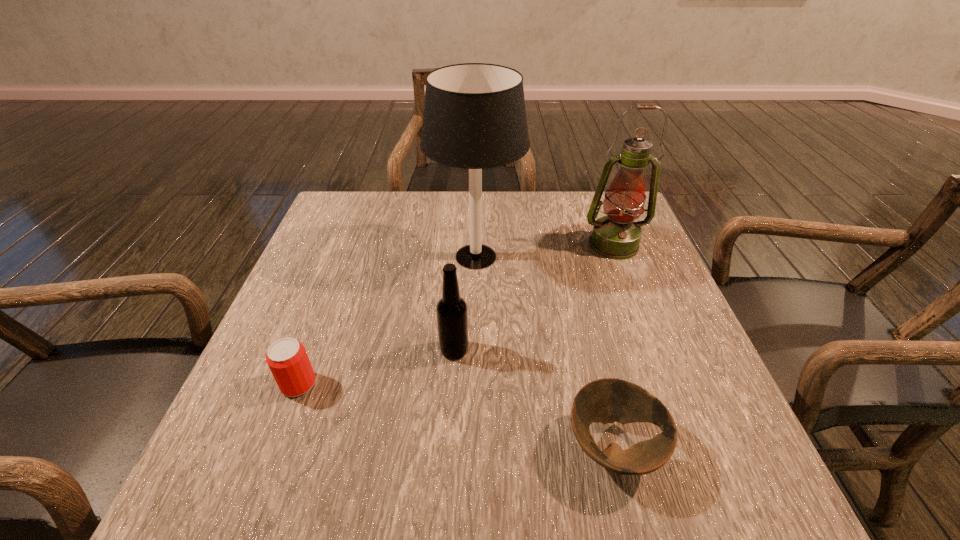
Identify the location of object at the near right corner. This screenshot has height=540, width=960. (608, 400).

This screenshot has width=960, height=540. I want to click on vacant space at the far edge of the desktop, so click(x=385, y=212).

Where is `vacant space at the near edge of the desktop`? vacant space at the near edge of the desktop is located at coordinates (588, 487).

Find the location of a particular element. The width and height of the screenshot is (960, 540). free point at the left edge is located at coordinates (276, 319).

Locate an element on the screen. The height and width of the screenshot is (540, 960). vacant space at the far left corner is located at coordinates (327, 216).

The width and height of the screenshot is (960, 540). I want to click on vacant space at the near right corner, so [748, 483].

Where is `free space between the fourth shortest object and the nearest object`? The image size is (960, 540). free space between the fourth shortest object and the nearest object is located at coordinates (613, 346).

Identify the location of free space between the nearest object and the leftmost object. The height and width of the screenshot is (540, 960). (456, 416).

Find the location of a particular element. The image size is (960, 540). unoccupied area between the beer bottle and the fourth farthest object is located at coordinates (376, 367).

You are a GUI agent. You are given a task and a screenshot of the screen. Output one action in this format:
    pyautogui.click(x=<x>, y=<y>)
    Task: Click on the free area in between the leftmost object and the shortest object
    The height and width of the screenshot is (540, 960).
    Given the screenshot: What is the action you would take?
    pyautogui.click(x=456, y=416)